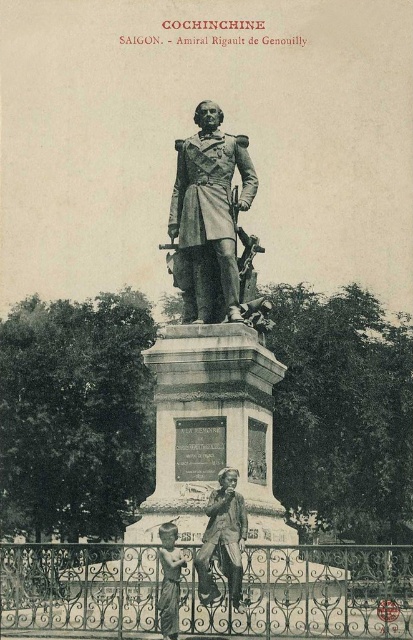
You are a tourist visiting the monument and want to take a photo of both the matte bronze statue at center and the matte bronze statue at lower center. Which statue should you position yourself to the right of to capture both in the frame?

You should position yourself to the right of the matte bronze statue at lower center to include both the matte bronze statue at center and the matte bronze statue at lower center in your photo, as the former is located to the right of the latter.